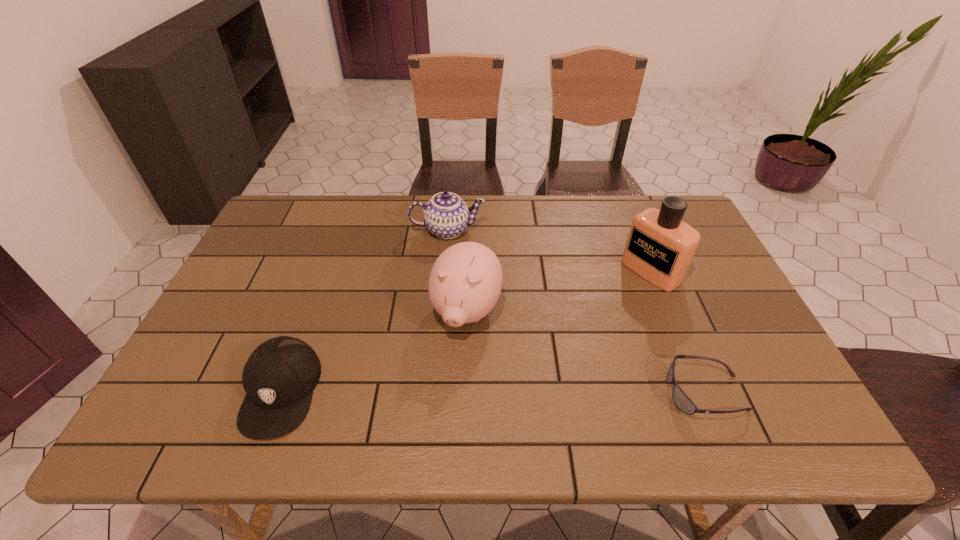
You are a GUI agent. You are given a task and a screenshot of the screen. Output one action in this format:
    pyautogui.click(x=<x>, y=<y>)
    Task: Click on the cap located at the near edge
    The image size is (960, 540).
    Given the screenshot: What is the action you would take?
    pyautogui.click(x=279, y=377)

At what (x,y) coordinates should I click in order to perform the action: click on sunglasses present at the near edge. Please return your answer as a coordinate pair (x, y). The width and height of the screenshot is (960, 540). Looking at the image, I should click on (681, 400).

Where is `sunglasses positioned at the right edge`? The width and height of the screenshot is (960, 540). sunglasses positioned at the right edge is located at coordinates (681, 400).

Identify the location of perfume at the right edge. pyautogui.click(x=660, y=247).

Locate an element on the screen. The width and height of the screenshot is (960, 540). object that is at the near right corner is located at coordinates (681, 400).

The height and width of the screenshot is (540, 960). I want to click on vacant space at the far edge of the desktop, so click(x=369, y=221).

This screenshot has height=540, width=960. Find the location of `free space at the near edge of the desktop`. free space at the near edge of the desktop is located at coordinates (455, 389).

Find the location of `vacant space at the left edge`. vacant space at the left edge is located at coordinates (236, 331).

Image resolution: width=960 pixels, height=540 pixels. Identify the location of vacant region at the right edge of the desktop. (695, 252).

Where is `vacant space at the far left corner`? Image resolution: width=960 pixels, height=540 pixels. vacant space at the far left corner is located at coordinates (283, 219).